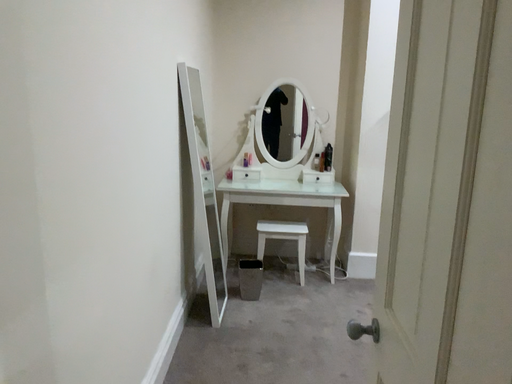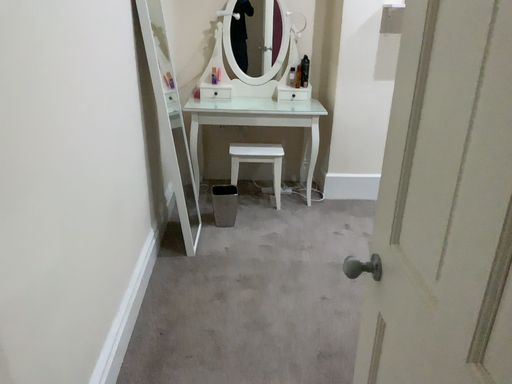
Question: Which way did the camera rotate in the video?

Choices:
 (A) rotated upward
 (B) rotated downward

Answer: (B)